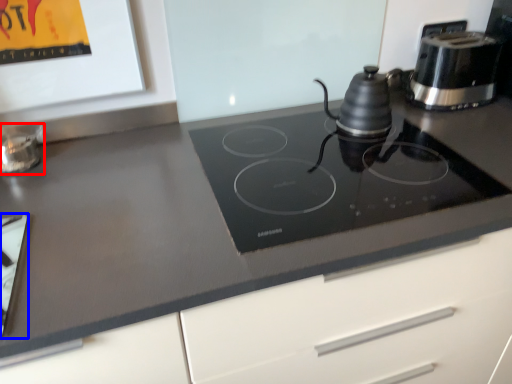
Question: Among these objects, which one is farthest to the camera, appliance (highlighted by a red box) or appliance (highlighted by a blue box)?

Choices:
 (A) appliance
 (B) appliance

Answer: (A)